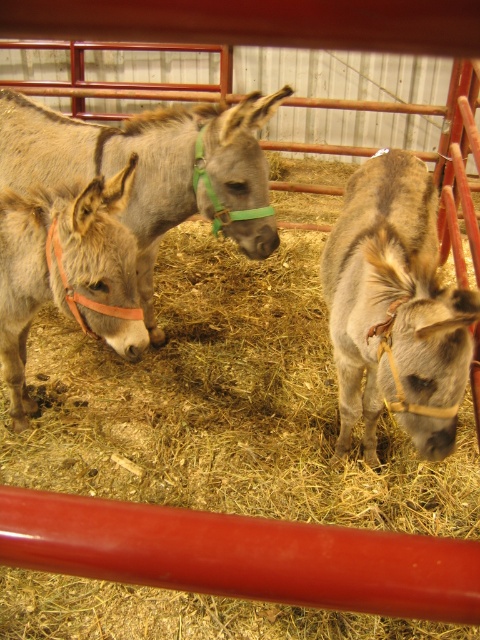
Does grayish-brown leather halter at center have a smaller size compared to gray matte donkey at left?

Yes.

Based on the photo, is grayish-brown leather halter at center above gray matte donkey at left?

Actually, grayish-brown leather halter at center is below gray matte donkey at left.

Which is behind, point (434, 358) or point (256, 96)?

Positioned behind is point (256, 96).

Locate an element on the screen. This screenshot has height=640, width=480. grayish-brown leather halter at center is located at coordinates coord(395,308).

Does gray matte donkey at left appear on the right side of light brown leather halter at left?

Indeed, gray matte donkey at left is positioned on the right side of light brown leather halter at left.

Looking at this image, who is taller, gray matte donkey at left or light brown leather halter at left?

gray matte donkey at left is taller.

Which is in front, point (278, 96) or point (48, 214)?

Positioned in front is point (48, 214).

Where is `gray matte donkey at left`? Image resolution: width=480 pixels, height=640 pixels. gray matte donkey at left is located at coordinates (155, 170).

Is grayish-brown leather halter at center taller than light brown leather halter at left?

Correct, grayish-brown leather halter at center is much taller as light brown leather halter at left.

Can you confirm if grayish-brown leather halter at center is positioned above light brown leather halter at left?

Correct, grayish-brown leather halter at center is located above light brown leather halter at left.

The height and width of the screenshot is (640, 480). I want to click on grayish-brown leather halter at center, so click(395, 308).